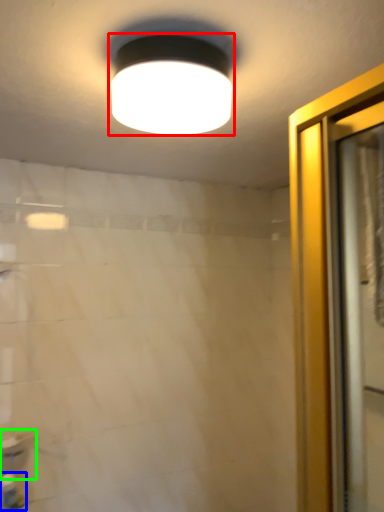
Question: Considering the real-world distances, which object is farthest from lamp (highlighted by a red box)? toiletry (highlighted by a blue box) or sink (highlighted by a green box)?

Choices:
 (A) toiletry
 (B) sink

Answer: (A)